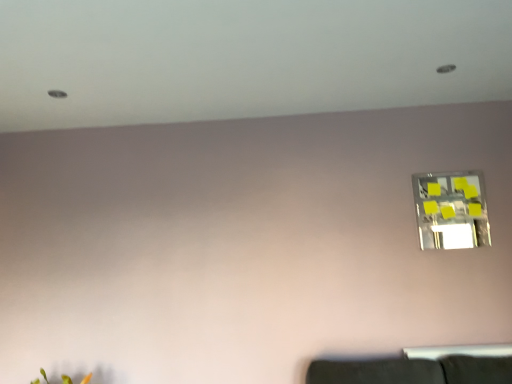
What are the coordinates of `transparent glass window at upper right` in the screenshot? It's located at (451, 210).

Describe the element at coordinates (451, 210) in the screenshot. This screenshot has width=512, height=384. I see `transparent glass window at upper right` at that location.

This screenshot has height=384, width=512. I want to click on transparent glass window at upper right, so pyautogui.click(x=451, y=210).